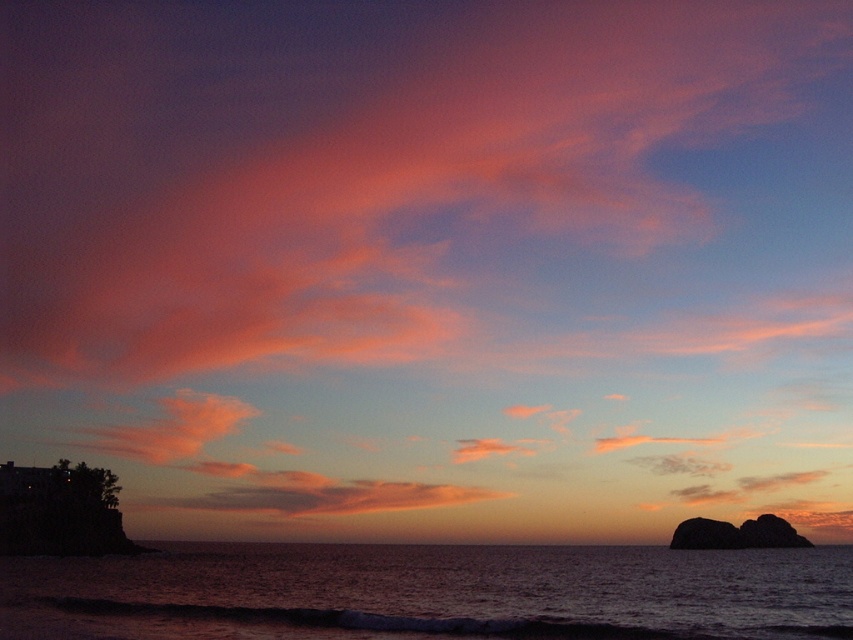
You are a photographer trying to capture the sunset. You have a camera with a 12MP sensor. The dark blue water at lower center and the smooth dark rock at lower right are both in your frame. Which object will occupy more pixels in your photo?

The dark blue water at lower center is bigger than the smooth dark rock at lower right, so it will occupy more pixels in the photo.

You are standing on the beach and see the dark blue water at lower center and the smooth dark rock at lower right. Which object is closer to the horizon?

The dark blue water at lower center is closer to the horizon because it is below the smooth dark rock at lower right, meaning it is positioned further away from the viewer and thus nearer to the horizon.